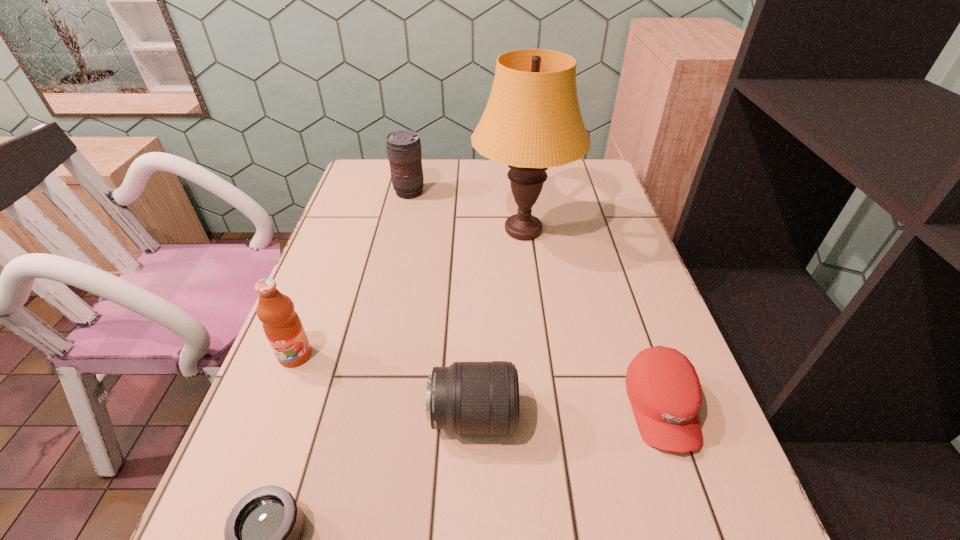
I want to click on the fifth nearest object, so click(x=532, y=121).

What are the coordinates of `lampshade` in the screenshot? It's located at (532, 121).

You are a GUI agent. You are given a task and a screenshot of the screen. Output one action in this format:
    pyautogui.click(x=<x>, y=<y>)
    Task: Click on the fruit juice
    
    Given the screenshot: What is the action you would take?
    pyautogui.click(x=282, y=326)

At what (x,y) coordinates should I click in order to perform the action: click on the tallest telephoto lens. Please return your answer as a coordinate pair (x, y). Looking at the image, I should click on (404, 152).

Locate an element on the screen. Image resolution: width=960 pixels, height=540 pixels. the farthest object is located at coordinates (404, 152).

At what (x,y) coordinates should I click in order to perform the action: click on the fourth tallest object. Please return your answer as a coordinate pair (x, y). The height and width of the screenshot is (540, 960). Looking at the image, I should click on (468, 398).

This screenshot has width=960, height=540. In order to click on the second nearest telephoto lens in this screenshot , I will do coord(468,398).

Where is `the rightmost object`? the rightmost object is located at coordinates (663, 387).

Identify the location of cap. (663, 387).

Locate an element on the screen. Image resolution: width=960 pixels, height=540 pixels. vacant space located 0.150m on the front of the tallest object is located at coordinates (533, 304).